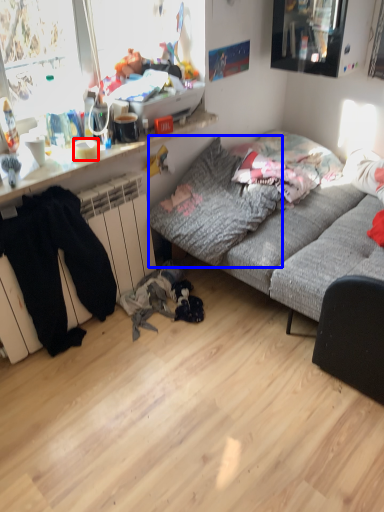
Question: Which of the following is the farthest to the observer, bowl (highlighted by a red box) or pillow (highlighted by a blue box)?

Choices:
 (A) bowl
 (B) pillow

Answer: (A)